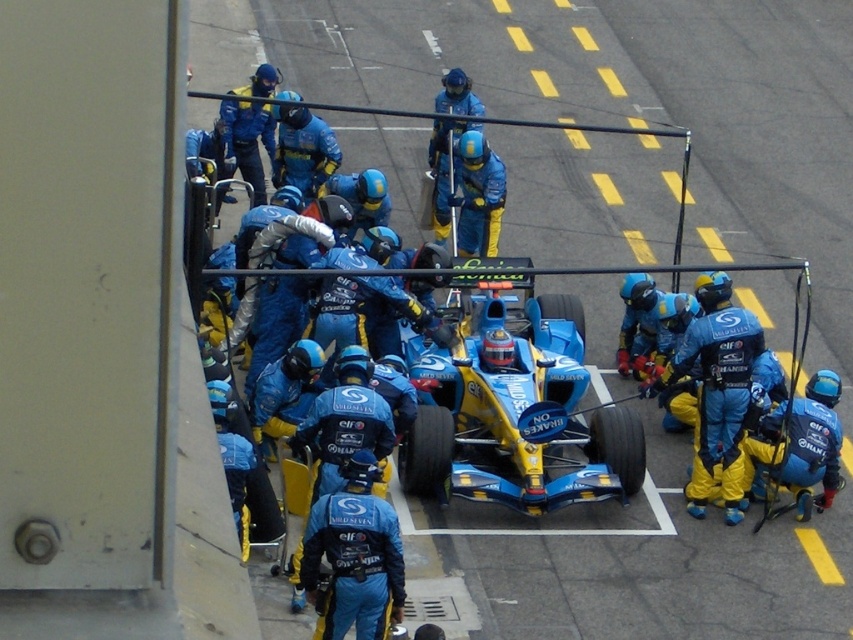
In the scene shown: You are a race engineer observing the pit stop scene. You notice a point marked at coordinates (354, 556). What object is located at that point?

The point at coordinates (354, 556) marks the location of the blue fabric suit at center.

You are a drone operator tasked with capturing aerial footage of the blue glossy race car at center during a Formula One pit stop. The drone must maintain a minimum altitude of 5 meters to avoid interfering with the mechanics. Given the car is at coordinates point 0.633, 0.601, can you confirm if the drone can safely hover above it without violating the altitude requirement?

The blue glossy race car at center is located at point (512, 404). Since the drone must maintain a minimum altitude of 5 meters, it can safely hover above the car as long as it stays at or above that height, which does not interfere with the mechanics working around the car.